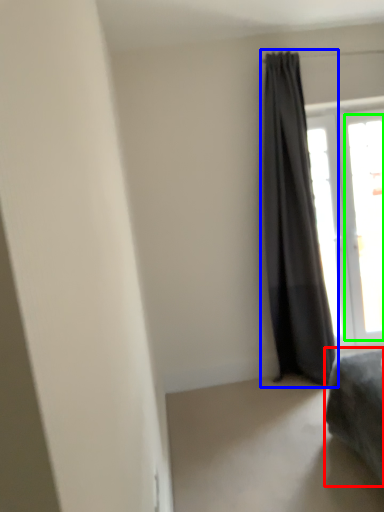
Question: Which object is the farthest from furniture (highlighted by a red box)? Choose among these: curtain (highlighted by a blue box) or window (highlighted by a green box).

Choices:
 (A) curtain
 (B) window

Answer: (B)